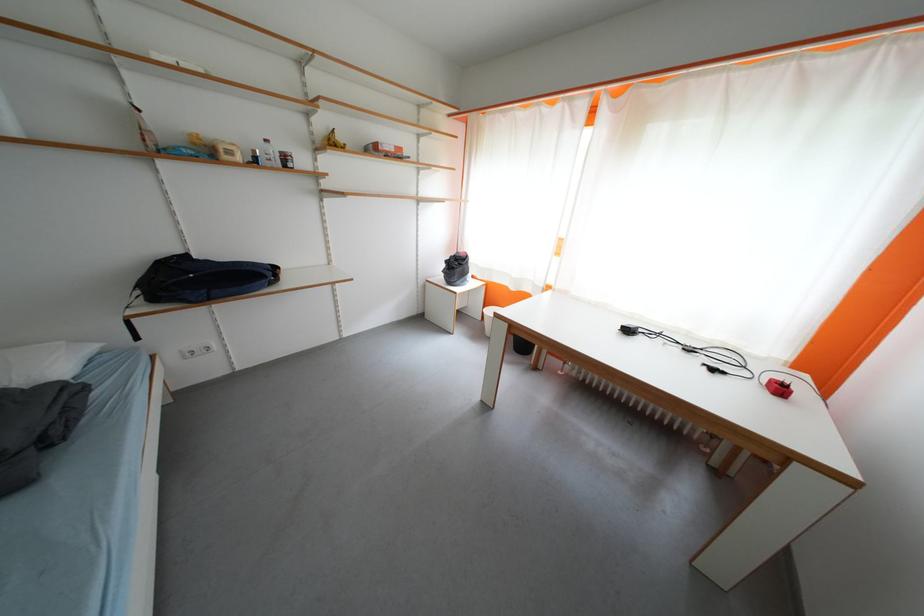
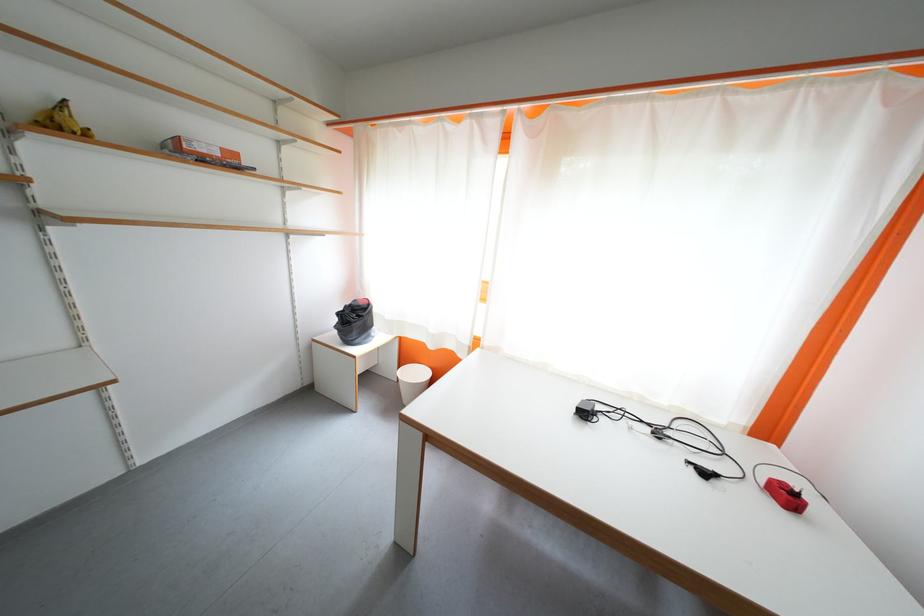
In the second image, find the point that corresponds to pixel 723 373 in the first image.

(713, 477)